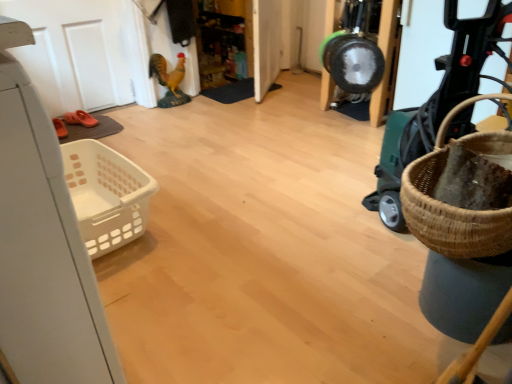
Question: Is shiny plastic rooster at upper center bigger than white matte door at upper left, acting as the 2th door starting from the right?

Choices:
 (A) no
 (B) yes

Answer: (A)

Question: Is shiny plastic rooster at upper center to the left of white matte door at upper left, which ranks as the 1th door in left-to-right order, from the viewer's perspective?

Choices:
 (A) yes
 (B) no

Answer: (B)

Question: From a real-world perspective, is shiny plastic rooster at upper center located beneath white matte door at upper left, which ranks as the 1th door in left-to-right order?

Choices:
 (A) no
 (B) yes

Answer: (B)

Question: From a real-world perspective, is shiny plastic rooster at upper center positioned over white matte door at upper left, which ranks as the 1th door in left-to-right order, based on gravity?

Choices:
 (A) no
 (B) yes

Answer: (A)

Question: Does shiny plastic rooster at upper center lie behind white matte door at upper left, which ranks as the 1th door in left-to-right order?

Choices:
 (A) yes
 (B) no

Answer: (A)

Question: Is white glossy door at center, the second door when ordered from left to right, inside the boundaries of green plastic baby carriage at right, or outside?

Choices:
 (A) inside
 (B) outside

Answer: (B)

Question: Is point (252, 23) closer or farther from the camera than point (403, 226)?

Choices:
 (A) farther
 (B) closer

Answer: (A)

Question: In the image, is white glossy door at center, which ranks as the 1th door in right-to-left order, positioned in front of or behind green plastic baby carriage at right?

Choices:
 (A) behind
 (B) front

Answer: (A)

Question: Based on their sizes in the image, would you say white glossy door at center, which ranks as the 1th door in right-to-left order, is bigger or smaller than green plastic baby carriage at right?

Choices:
 (A) big
 (B) small

Answer: (B)

Question: Considering the positions of shiny plastic rooster at upper center and white glossy door at center, which ranks as the 1th door in right-to-left order, in the image, is shiny plastic rooster at upper center bigger or smaller than white glossy door at center, which ranks as the 1th door in right-to-left order,?

Choices:
 (A) big
 (B) small

Answer: (B)

Question: Would you say shiny plastic rooster at upper center is to the left or to the right of white glossy door at center, the second door when ordered from left to right, in the picture?

Choices:
 (A) left
 (B) right

Answer: (A)

Question: Looking at their shapes, would you say shiny plastic rooster at upper center is wider or thinner than white glossy door at center, the second door when ordered from left to right?

Choices:
 (A) wide
 (B) thin

Answer: (A)

Question: Relative to white glossy door at center, the second door when ordered from left to right, is shiny plastic rooster at upper center in front or behind?

Choices:
 (A) front
 (B) behind

Answer: (B)

Question: In terms of width, does white matte door at upper left, which ranks as the 1th door in left-to-right order, look wider or thinner when compared to white glossy door at center, the second door when ordered from left to right?

Choices:
 (A) wide
 (B) thin

Answer: (A)

Question: From the image's perspective, relative to white glossy door at center, the second door when ordered from left to right, is white matte door at upper left, acting as the 2th door starting from the right, above or below?

Choices:
 (A) above
 (B) below

Answer: (B)